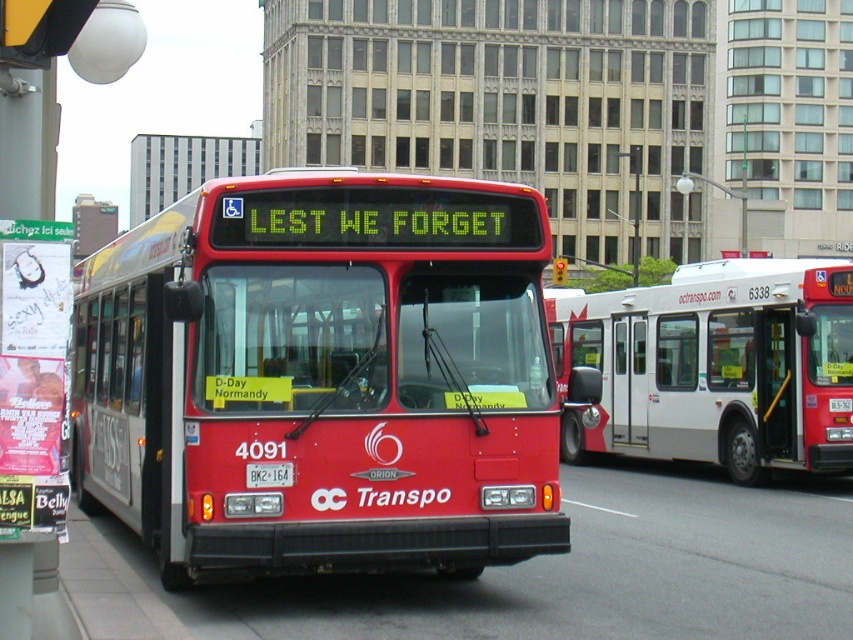
You are a delivery person trying to load a package onto the roof of the white matte bus at center. The package is 2 meters tall. Can you safely place it there without hitting the white plastic license plate at center?

The white matte bus at center is much taller than the white plastic license plate at center, so there is enough vertical space to safely place the 2 meter tall package on the roof without hitting the license plate.

Please look at the point marked at coordinate (322,376). Which object in the image does this point correspond to?

The point at coordinate (322,376) corresponds to the matte red bus at center.

You are a pedestrian standing on the sidewalk observing the two buses. Which bus, the matte red bus at center or the white matte bus at center, has a greater width?

The matte red bus at center has a greater width than the white matte bus at center according to the description.